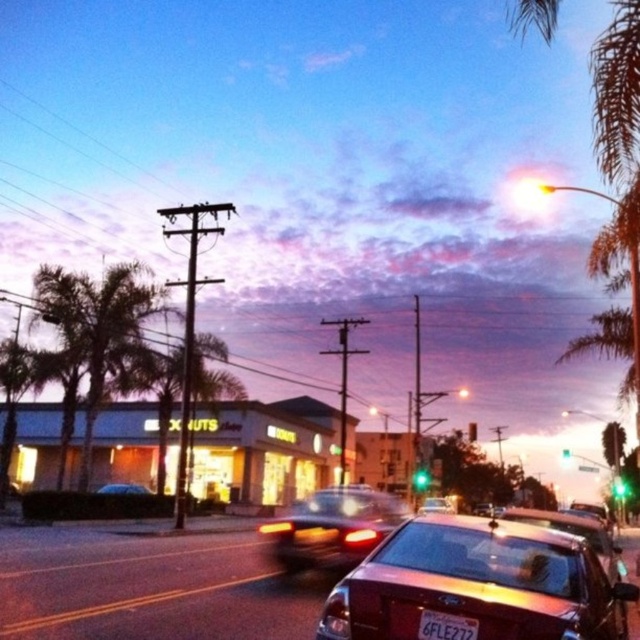
Is point (348, 548) closer to camera compared to point (424, 636)?

No, (348, 548) is further to viewer.

Does metallic silver car at center appear on the right side of white plastic license plate at center?

In fact, metallic silver car at center is to the left of white plastic license plate at center.

Measure the distance between metallic silver car at center and camera.

32.71 feet

You are a GUI agent. You are given a task and a screenshot of the screen. Output one action in this format:
    pyautogui.click(x=<x>, y=<y>)
    Task: Click on the metallic silver car at center
    This screenshot has height=640, width=640.
    Given the screenshot: What is the action you would take?
    pyautogui.click(x=332, y=528)

Does point (573, 550) come behind point (528, 508)?

No.

Does shiny red sedan at center have a lesser height compared to shiny metallic car at center?

Indeed, shiny red sedan at center has a lesser height compared to shiny metallic car at center.

What are the coordinates of `shiny red sedan at center` in the screenshot? It's located at (477, 582).

Can you confirm if metallic silver car at center is shorter than satin black sedan at center?

No.

Is metallic silver car at center in front of satin black sedan at center?

That is True.

Does point (339, 532) come behind point (449, 500)?

No.

Where is `metallic silver car at center`? metallic silver car at center is located at coordinates (332, 528).